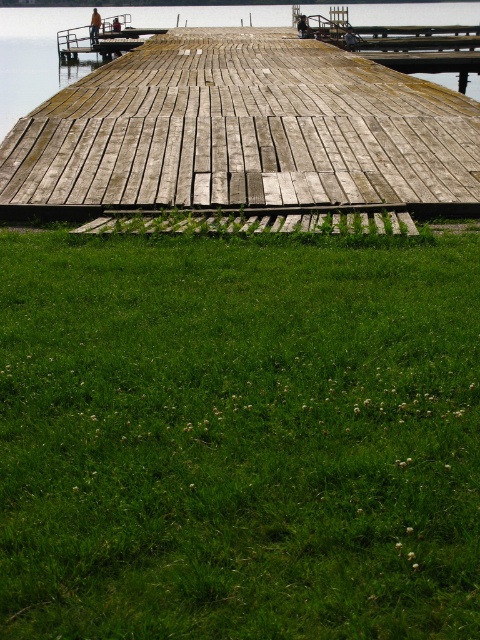
This screenshot has height=640, width=480. What do you see at coordinates (239, 436) in the screenshot?
I see `green grass at lower center` at bounding box center [239, 436].

The image size is (480, 640). What do you see at coordinates (239, 436) in the screenshot?
I see `green grass at lower center` at bounding box center [239, 436].

Where is `green grass at lower center`? The height and width of the screenshot is (640, 480). green grass at lower center is located at coordinates [x=239, y=436].